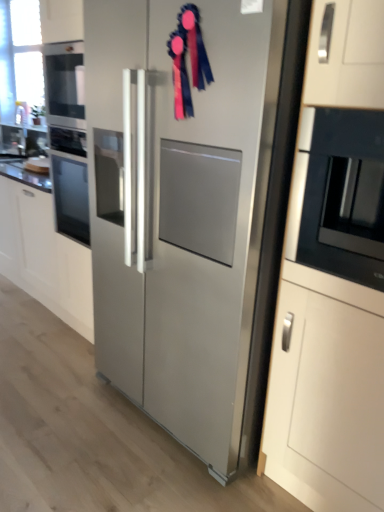
This screenshot has width=384, height=512. What do you see at coordinates (190, 59) in the screenshot? I see `blue satin ribbon at upper center` at bounding box center [190, 59].

The width and height of the screenshot is (384, 512). What do you see at coordinates (180, 204) in the screenshot? I see `stainless steel refrigerator at center` at bounding box center [180, 204].

This screenshot has height=512, width=384. Describe the element at coordinates (24, 174) in the screenshot. I see `white glossy countertop at left` at that location.

In order to face white glossy countertop at left, should I rotate leftwards or rightwards?

Turn left approximately 22.146 degrees to face it.

Locate an element on the screen. The image size is (384, 512). black glossy microwave at right is located at coordinates (339, 195).

Find the location of a particular element. This screenshot has height=512, width=384. cabinetry below the blue satin ribbon at upper center (from a real-world perspective) is located at coordinates (44, 256).

From a real-world perspective, between blue satin ribbon at upper center and satin white cabinet at center, who is vertically lower?

satin white cabinet at center is physically lower.

Considering the positions of objects blue satin ribbon at upper center and satin white cabinet at center in the image provided, who is more to the left, blue satin ribbon at upper center or satin white cabinet at center?

Positioned to the left is satin white cabinet at center.

Between blue satin ribbon at upper center and black glossy microwave at right, which one is positioned in front?

black glossy microwave at right is in front.

Is blue satin ribbon at upper center to the left of black glossy microwave at right from the viewer's perspective?

Indeed, blue satin ribbon at upper center is positioned on the left side of black glossy microwave at right.

The image size is (384, 512). What are the coordinates of `microwave oven in front of the blue satin ribbon at upper center` in the screenshot? It's located at (339, 195).

Between stainless steel refrigerator at center and brushed metal sink at left, which one is positioned behind?

brushed metal sink at left is further from the camera.

Between point (128, 54) and point (20, 151), which one is positioned behind?

The point (20, 151) is farther from the camera.

Is stainless steel refrigerator at center bigger or smaller than brushed metal sink at left?

Clearly, stainless steel refrigerator at center is larger in size than brushed metal sink at left.

From a real-world perspective, does stainless steel refrigerator at center sit lower than brushed metal sink at left?

Correct, in the physical world, stainless steel refrigerator at center is lower than brushed metal sink at left.

Between point (242, 20) and point (318, 249), which one is positioned behind?

The point (318, 249) is farther.

From a real-world perspective, who is located lower, stainless steel refrigerator at center or black glossy microwave at right?

In real-world perspective, stainless steel refrigerator at center is lower.

Does stainless steel refrigerator at center lie in front of black glossy microwave at right?

Yes, stainless steel refrigerator at center is closer to the camera.

From the image's perspective, is stainless steel refrigerator at center under black glossy microwave at right?

Yes, from the image's perspective, stainless steel refrigerator at center is below black glossy microwave at right.

Is satin white cabinet at center placed right next to stainless steel refrigerator at center?

No, satin white cabinet at center is not touching stainless steel refrigerator at center.

How many degrees apart are the facing directions of satin white cabinet at center and stainless steel refrigerator at center?

0.307 degrees separate the facing orientations of satin white cabinet at center and stainless steel refrigerator at center.

Between point (59, 307) and point (140, 343), which one is positioned in front?

Positioned in front is point (140, 343).

From the picture: Considering the relative sizes of satin white cabinet at center and stainless steel refrigerator at center in the image provided, is satin white cabinet at center wider than stainless steel refrigerator at center?

In fact, satin white cabinet at center might be narrower than stainless steel refrigerator at center.

Is brushed metal sink at left facing towards white glossy countertop at left?

No, brushed metal sink at left does not turn towards white glossy countertop at left.

From the image's perspective, is brushed metal sink at left over white glossy countertop at left?

Indeed, from the image's perspective, brushed metal sink at left is shown above white glossy countertop at left.

Can you tell me how much brushed metal sink at left and white glossy countertop at left differ in facing direction?

brushed metal sink at left and white glossy countertop at left are facing 0.442 degrees away from each other.

Is black glossy microwave at right positioned in front of brushed metal sink at left?

Yes, black glossy microwave at right is closer to the viewer.

From the image's perspective, is black glossy microwave at right located above or below brushed metal sink at left?

black glossy microwave at right is situated lower than brushed metal sink at left in the image.

How different are the orientations of black glossy microwave at right and brushed metal sink at left in degrees?

The facing directions of black glossy microwave at right and brushed metal sink at left are 0.442 degrees apart.

Considering the positions of point (381, 116) and point (12, 129), is point (381, 116) closer or farther from the camera than point (12, 129)?

Point (381, 116) is closer to the camera than point (12, 129).

Where is `ribbon above the satin white cabinet at center (from a real-world perspective)`? The height and width of the screenshot is (512, 384). ribbon above the satin white cabinet at center (from a real-world perspective) is located at coordinates coord(190,59).

You are a GUI agent. You are given a task and a screenshot of the screen. Output one action in this format:
    pyautogui.click(x=<x>, y=<y>)
    Task: Click on the microwave oven below the blue satin ribbon at upper center (from the image's perspective)
    The width and height of the screenshot is (384, 512).
    Given the screenshot: What is the action you would take?
    pyautogui.click(x=339, y=195)

Looking at the image, which one is located closer to stainless steel refrigerator at center, brushed metal sink at left or blue satin ribbon at upper center?

blue satin ribbon at upper center is positioned closer to the anchor stainless steel refrigerator at center.

Looking at the image, which one is located further to stainless steel refrigerator at center, white glossy countertop at left or satin white cabinet at center?

The object further to stainless steel refrigerator at center is white glossy countertop at left.

Considering their positions, is black glossy microwave at right positioned further to satin white cabinet at center than brushed metal sink at left?

Among the two, black glossy microwave at right is located further to satin white cabinet at center.

Estimate the real-world distances between objects in this image. Which object is closer to blue satin ribbon at upper center, white glossy countertop at left or stainless steel refrigerator at center?

Based on the image, stainless steel refrigerator at center appears to be nearer to blue satin ribbon at upper center.

Which object lies further to the anchor point white glossy countertop at left, satin white cabinet at center or stainless steel refrigerator at center?

stainless steel refrigerator at center is further to white glossy countertop at left.

From the image, which object appears to be nearer to stainless steel refrigerator at center, black glossy microwave at right or satin white cabinet at center?

black glossy microwave at right lies closer to stainless steel refrigerator at center than the other object.

Considering their positions, is white glossy countertop at left positioned further to stainless steel refrigerator at center than blue satin ribbon at upper center?

Based on the image, white glossy countertop at left appears to be further to stainless steel refrigerator at center.

Looking at the image, which one is located further to blue satin ribbon at upper center, stainless steel refrigerator at center or white glossy countertop at left?

The object further to blue satin ribbon at upper center is white glossy countertop at left.

Locate an element on the screen. ribbon between black glossy microwave at right and brushed metal sink at left from front to back is located at coordinates (190, 59).

This screenshot has width=384, height=512. In order to click on countertop between stainless steel refrigerator at center and brushed metal sink at left along the z-axis in this screenshot , I will do `click(24, 174)`.

In order to click on sink between satin white cabinet at center and black glossy microwave at right in this screenshot , I will do `click(22, 142)`.

The image size is (384, 512). I want to click on ribbon between stainless steel refrigerator at center and brushed metal sink at left from front to back, so click(190, 59).